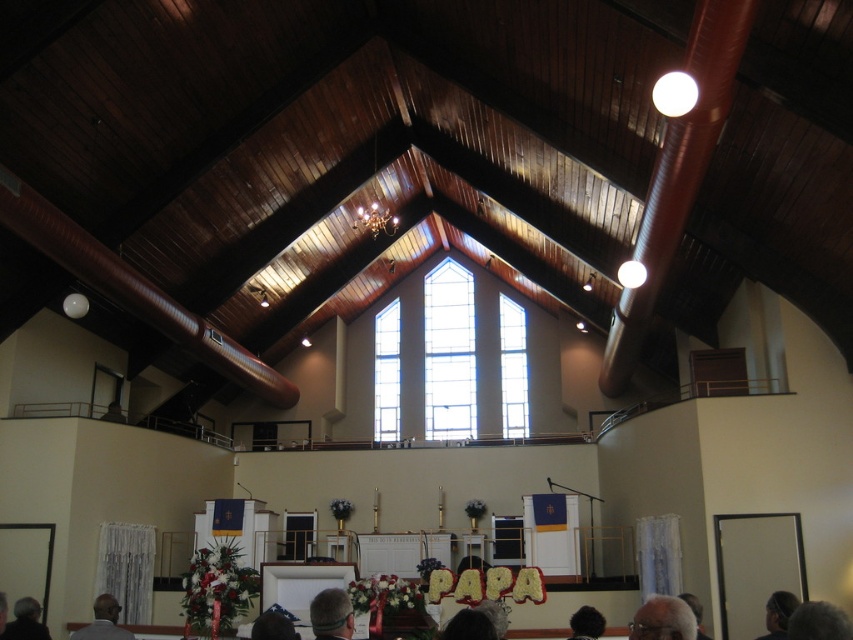
Does gray hair at lower center have a greater height compared to dark gray hair at lower left?

No.

How far apart are gray hair at lower center and dark gray hair at lower left?

gray hair at lower center and dark gray hair at lower left are 9.33 meters apart.

Locate an element on the screen. This screenshot has width=853, height=640. gray hair at lower center is located at coordinates (331, 614).

Between dark gray hair at lower left and black fur hat at lower center, which one is positioned lower?

black fur hat at lower center

Consider the image. Is dark gray hair at lower left below black fur hat at lower center?

No, dark gray hair at lower left is not below black fur hat at lower center.

Image resolution: width=853 pixels, height=640 pixels. What do you see at coordinates (25, 621) in the screenshot?
I see `dark gray hair at lower left` at bounding box center [25, 621].

Where is `dark gray hair at lower left`? dark gray hair at lower left is located at coordinates point(25,621).

Does gray hair at lower left appear on the left side of dark gray hair at lower left?

Yes, gray hair at lower left is to the left of dark gray hair at lower left.

From the picture: Can you confirm if gray hair at lower left is positioned below dark gray hair at lower left?

Indeed, gray hair at lower left is positioned under dark gray hair at lower left.

Which is in front, point (100, 612) or point (44, 628)?

Point (44, 628)

Find the location of a particular element. The image size is (853, 640). gray hair at lower left is located at coordinates (103, 621).